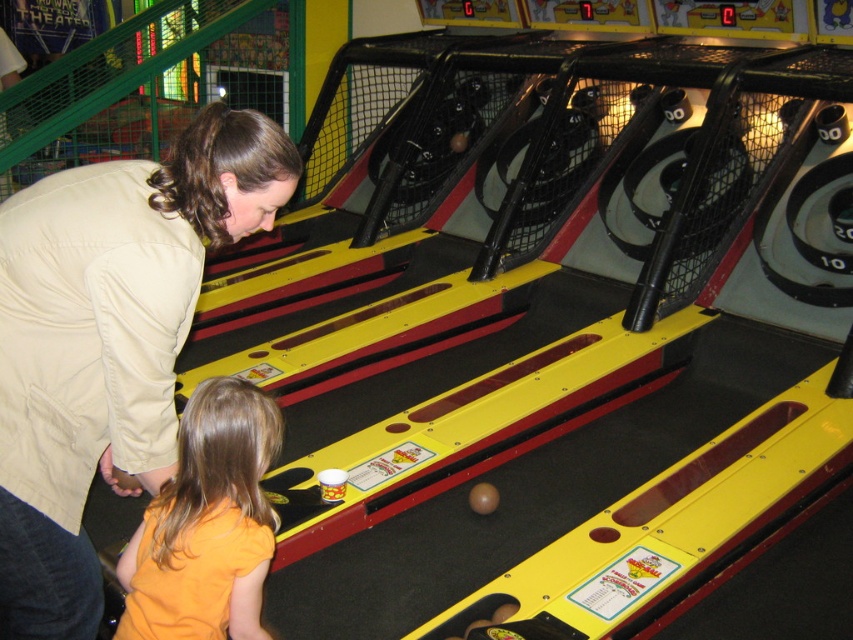
You are trying to decide which shirt to take from the arcade game prizes. The beige fabric shirt at center and the orange cotton shirt at lower left are both available. Based on their sizes, which one could you wear if you have a larger frame?

The beige fabric shirt at center might be wider than orange cotton shirt at lower left, so it could be more suitable for someone with a larger frame.

You are a game attendant in an arcade and need to hand out flyers to two customers wearing the beige fabric shirt at center and orange cotton shirt at lower left. The minimum distance required between you and each customer for safety is 6 inches. Can you safely hand out flyers to both customers at the same time while maintaining the required distance?

The beige fabric shirt at center and orange cotton shirt at lower left are 8.16 inches apart. Since the minimum required distance is 6 inches, you can safely hand out flyers to both customers as the distance between them allows maintaining the safety distance.

You are a customer in the arcade and see two people wearing shirts. The beige fabric shirt at center and the orange cotton shirt at lower left. Which shirt is located to the left of the other?

The beige fabric shirt at center is positioned on the left side of orange cotton shirt at lower left.